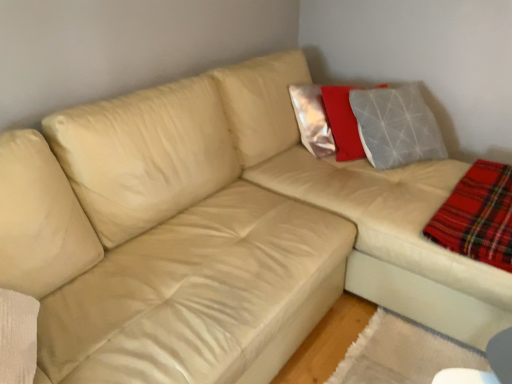
Question: Should I look upward or downward to see red plaid flannel at lower right?

Choices:
 (A) down
 (B) up

Answer: (A)